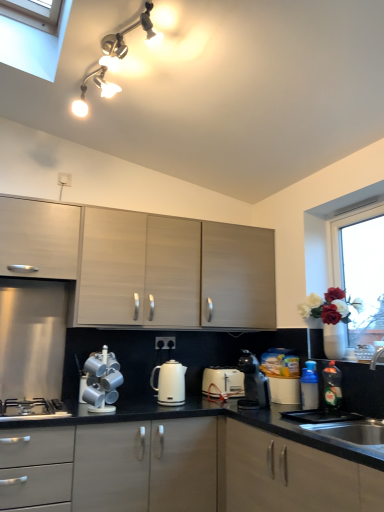
Question: Considering the relative sizes of green glossy bottle at lower right, acting as the first bottle starting from the right, and matte white cabinet at upper left, the 3th cabinetry from the bottom, in the image provided, is green glossy bottle at lower right, acting as the first bottle starting from the right, bigger than matte white cabinet at upper left, the 3th cabinetry from the bottom,?

Choices:
 (A) yes
 (B) no

Answer: (B)

Question: Considering the relative sizes of green glossy bottle at lower right, the second bottle in the left-to-right sequence, and matte white cabinet at upper left, the first cabinetry in the top-to-bottom sequence, in the image provided, is green glossy bottle at lower right, the second bottle in the left-to-right sequence, smaller than matte white cabinet at upper left, the first cabinetry in the top-to-bottom sequence,?

Choices:
 (A) yes
 (B) no

Answer: (A)

Question: Considering the relative positions of green glossy bottle at lower right, acting as the first bottle starting from the right, and matte white cabinet at upper left, the 3th cabinetry from the bottom, in the image provided, is green glossy bottle at lower right, acting as the first bottle starting from the right, behind matte white cabinet at upper left, the 3th cabinetry from the bottom,?

Choices:
 (A) no
 (B) yes

Answer: (B)

Question: From the image's perspective, is green glossy bottle at lower right, the second bottle in the left-to-right sequence, located beneath matte white cabinet at upper left, the first cabinetry in the top-to-bottom sequence?

Choices:
 (A) no
 (B) yes

Answer: (B)

Question: Is green glossy bottle at lower right, the second bottle in the left-to-right sequence, far away from matte white cabinet at upper left, the 3th cabinetry from the bottom?

Choices:
 (A) no
 (B) yes

Answer: (B)

Question: Considering the positions of point (246, 371) and point (170, 385), is point (246, 371) closer or farther from the camera than point (170, 385)?

Choices:
 (A) closer
 (B) farther

Answer: (B)

Question: Which is correct: black plastic coffee maker at center, the 1th kitchen appliance in the right-to-left sequence, is inside white glossy electric kettle at center, arranged as the 2th kitchen appliance when viewed from the right, or outside of it?

Choices:
 (A) outside
 (B) inside

Answer: (A)

Question: Looking at their shapes, would you say black plastic coffee maker at center, which is the 2th kitchen appliance from left to right, is wider or thinner than white glossy electric kettle at center, which is the 1th kitchen appliance in left-to-right order?

Choices:
 (A) thin
 (B) wide

Answer: (A)

Question: Considering their positions, is black plastic coffee maker at center, which is the 2th kitchen appliance from left to right, located in front of or behind white glossy electric kettle at center, arranged as the 2th kitchen appliance when viewed from the right?

Choices:
 (A) front
 (B) behind

Answer: (A)

Question: Is point 302,408 closer or farther from the camera than point 322,375?

Choices:
 (A) closer
 (B) farther

Answer: (A)

Question: From a real-world perspective, is blue plastic bottle at lower right, placed as the 1th bottle when sorted from left to right, positioned above or below green glossy bottle at lower right, acting as the first bottle starting from the right?

Choices:
 (A) above
 (B) below

Answer: (B)

Question: Is blue plastic bottle at lower right, placed as the 1th bottle when sorted from left to right, spatially inside green glossy bottle at lower right, acting as the first bottle starting from the right, or outside of it?

Choices:
 (A) outside
 (B) inside

Answer: (A)

Question: Is blue plastic bottle at lower right, placed as the 1th bottle when sorted from left to right, in front of or behind green glossy bottle at lower right, the second bottle in the left-to-right sequence, in the image?

Choices:
 (A) behind
 (B) front

Answer: (A)

Question: From the image's perspective, is white glossy vase at right located above or below silver metallic mugs at lower center, positioned as the second appliance in back-to-front order?

Choices:
 (A) below
 (B) above

Answer: (B)

Question: In the image, is white glossy vase at right on the left side or the right side of silver metallic mugs at lower center, which ranks as the first appliance in front-to-back order?

Choices:
 (A) left
 (B) right

Answer: (B)